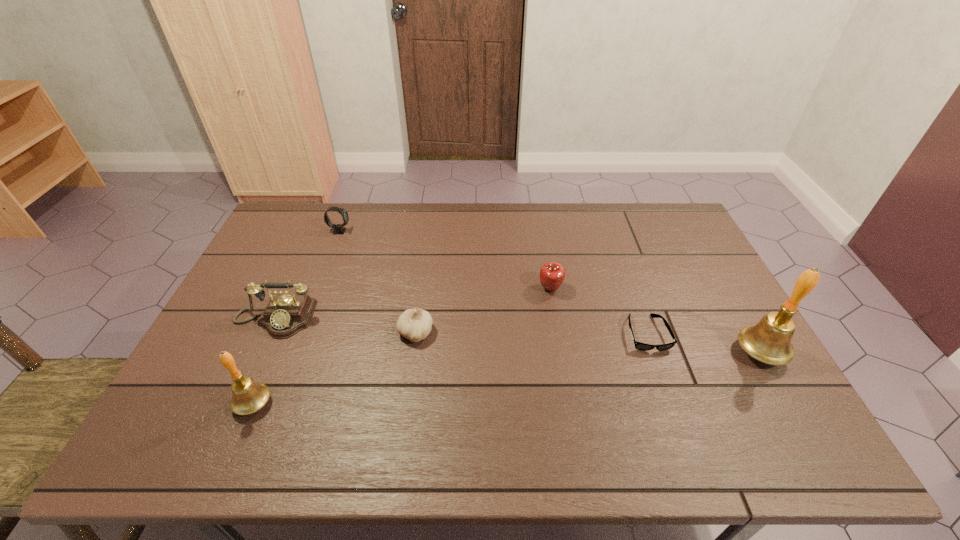
Find the location of `free location that satisfies the following two spatial constraints: 1. on the dial of the telephone; 2. on the left side of the fourth object from right to left`. free location that satisfies the following two spatial constraints: 1. on the dial of the telephone; 2. on the left side of the fourth object from right to left is located at coordinates (269, 333).

Image resolution: width=960 pixels, height=540 pixels. I want to click on vacant space that satisfies the following two spatial constraints: 1. on the dial of the rightmost object; 2. on the right side of the telephone, so click(260, 353).

Image resolution: width=960 pixels, height=540 pixels. I want to click on vacant space that satisfies the following two spatial constraints: 1. on the front-facing side of the taller bell; 2. on the left side of the sunglasses, so click(654, 353).

Identify the location of free point that satisfies the following two spatial constraints: 1. on the face of the taller bell; 2. on the left side of the farthest object. (293, 353).

Where is `vacant region that satisfies the following two spatial constraints: 1. on the face of the watch; 2. on the right side of the garlic`? The image size is (960, 540). vacant region that satisfies the following two spatial constraints: 1. on the face of the watch; 2. on the right side of the garlic is located at coordinates (300, 333).

The height and width of the screenshot is (540, 960). Find the location of `vacant space that satisfies the following two spatial constraints: 1. on the front side of the fourth object from left to right; 2. on the left side of the tallest object`. vacant space that satisfies the following two spatial constraints: 1. on the front side of the fourth object from left to right; 2. on the left side of the tallest object is located at coordinates (413, 353).

Locate an element on the screen. vacant space that satisfies the following two spatial constraints: 1. on the face of the fourth object from left to right; 2. on the right side of the watch is located at coordinates 300,333.